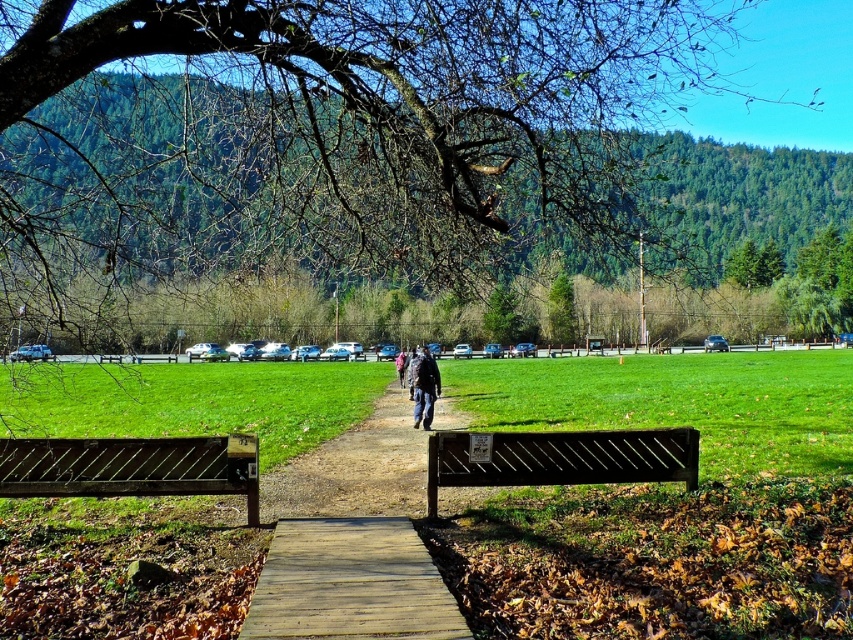
You are standing at the start of the wooden boardwalk at center and want to reach the dark blue jacket at center. Which direction should you walk to get closer to the jacket?

The wooden boardwalk at center is in front of the dark blue jacket at center, so you should walk backward to get closer to the jacket.

You are a person carrying a large backpack and need to sit down. You see a brown wooden bench at center and a dark blue jacket at center. Which object can you sit on?

The brown wooden bench at center is designed for sitting, while the dark blue jacket at center is an item of clothing meant to be worn. Therefore, you should sit on the brown wooden bench at center.